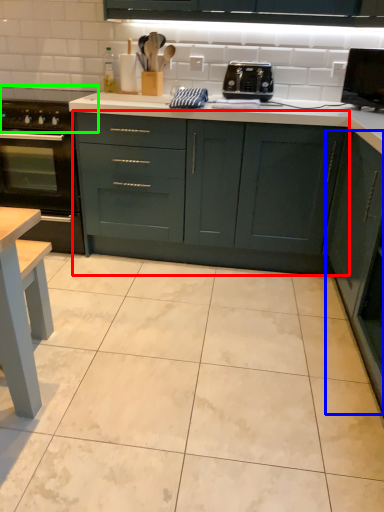
Question: Which is farther away from cabinetry (highlighted by a red box)? cabinetry (highlighted by a blue box) or gas stove (highlighted by a green box)?

Choices:
 (A) cabinetry
 (B) gas stove

Answer: (B)